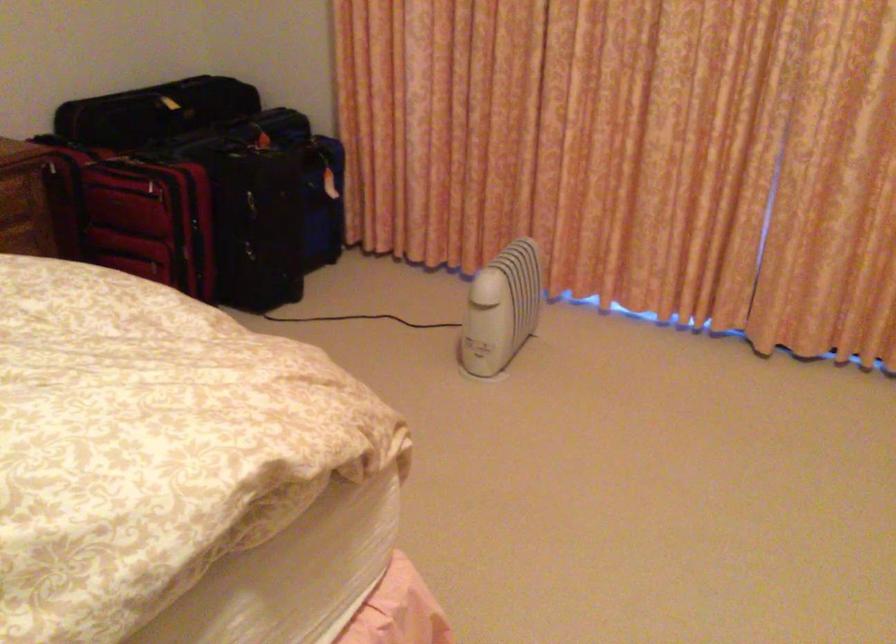
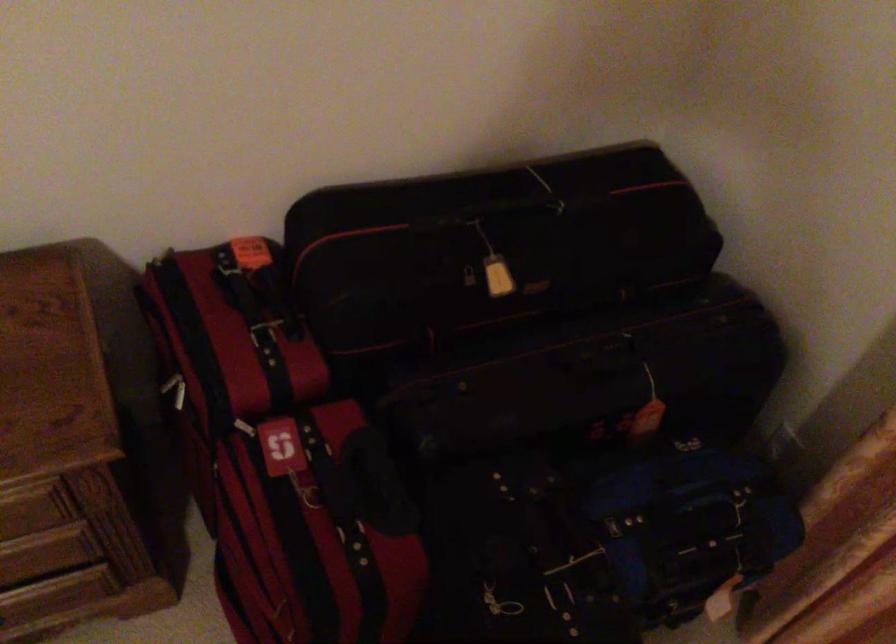
The point at (205, 131) is marked in the first image. Where is the corresponding point in the second image?

(527, 357)